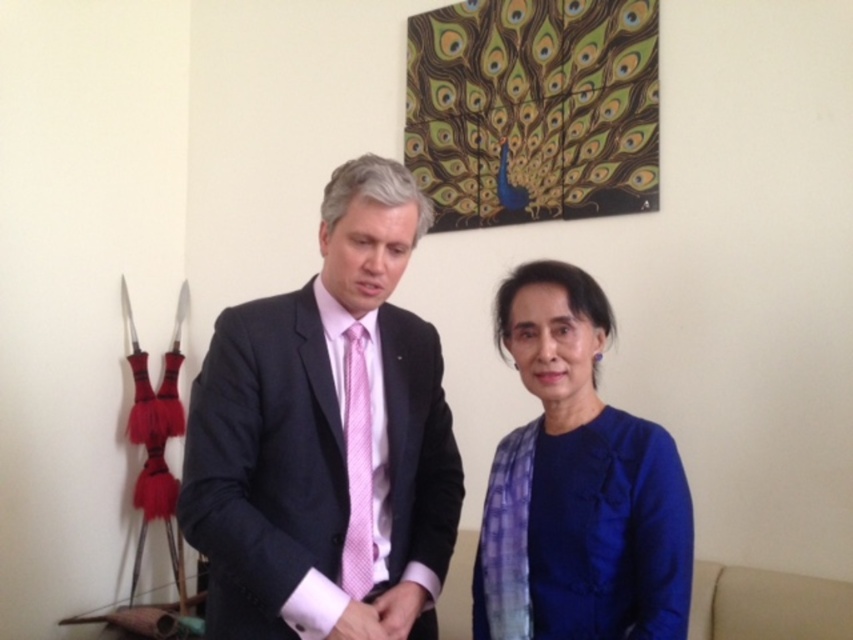
Question: Estimate the real-world distances between objects in this image. Which object is farther from the pink textured tie at center?

Choices:
 (A) blue cotton sweater at center
 (B) matte black suit at center

Answer: (A)

Question: Which point is farther to the camera?

Choices:
 (A) (222, 566)
 (B) (361, 358)
 (C) (550, 396)

Answer: (B)

Question: Is matte black suit at center thinner than blue cotton sweater at center?

Choices:
 (A) yes
 (B) no

Answer: (B)

Question: In this image, where is matte black suit at center located relative to pink textured tie at center?

Choices:
 (A) left
 (B) right

Answer: (B)

Question: Among these objects, which one is farthest from the camera?

Choices:
 (A) blue cotton sweater at center
 (B) matte black suit at center
 (C) pink textured tie at center

Answer: (C)

Question: Can you confirm if blue cotton sweater at center is smaller than pink textured tie at center?

Choices:
 (A) yes
 (B) no

Answer: (B)